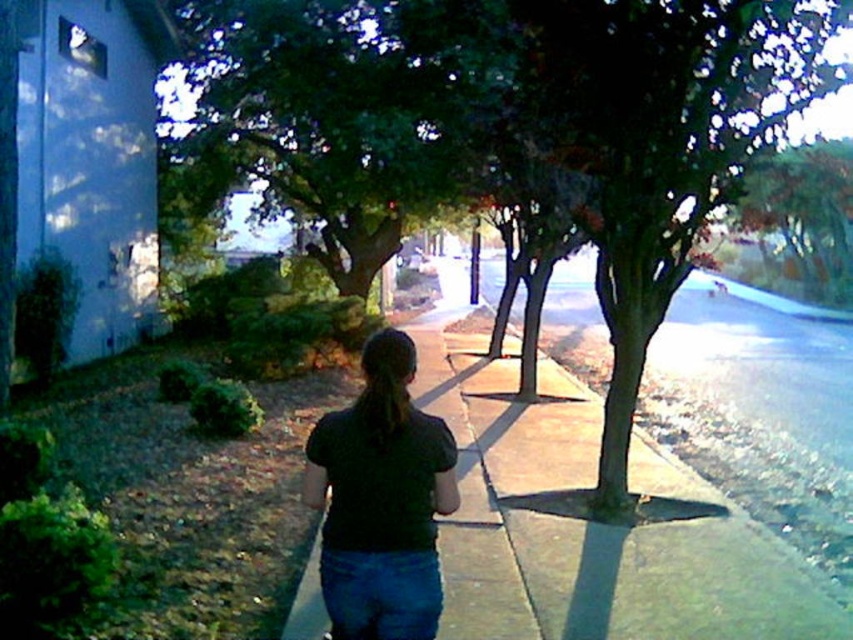
You are a pedestrian standing on the sidewalk. You notice the green leafy tree at upper center and the blue denim jeans at center. Which object is higher in the image?

The green leafy tree at upper center is higher in the image than the blue denim jeans at center.

You are standing at the point marked as point [341,109] in the image. What object is located exactly at that point?

The green leafy tree at upper center is located exactly at point [341,109].